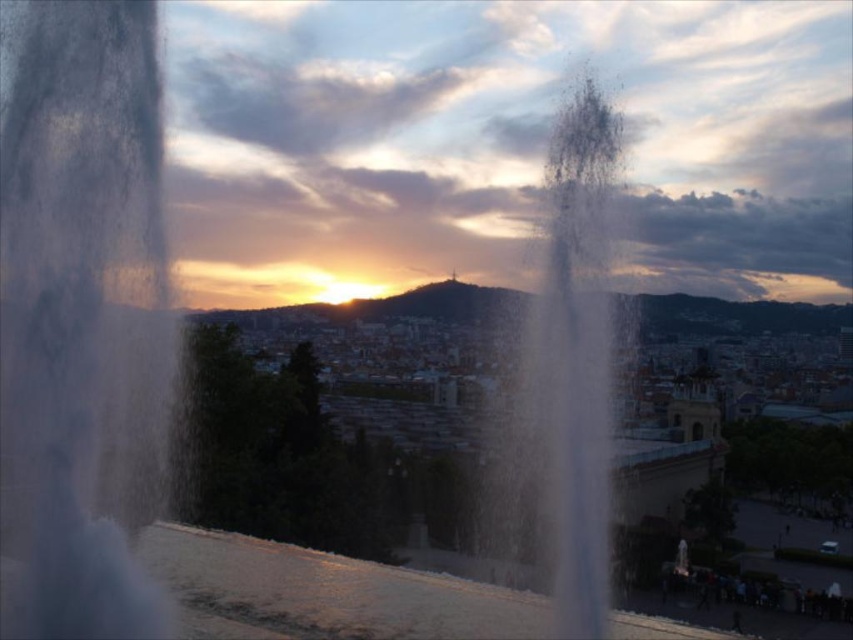
Question: Is transparent water at center positioned in front of transparent mist at center?

Choices:
 (A) no
 (B) yes

Answer: (B)

Question: Is transparent water at center below transparent mist at center?

Choices:
 (A) no
 (B) yes

Answer: (A)

Question: Does transparent water at center lie behind transparent mist at center?

Choices:
 (A) yes
 (B) no

Answer: (B)

Question: Which of the following is the farthest from the observer?

Choices:
 (A) (105, 515)
 (B) (577, 397)

Answer: (A)